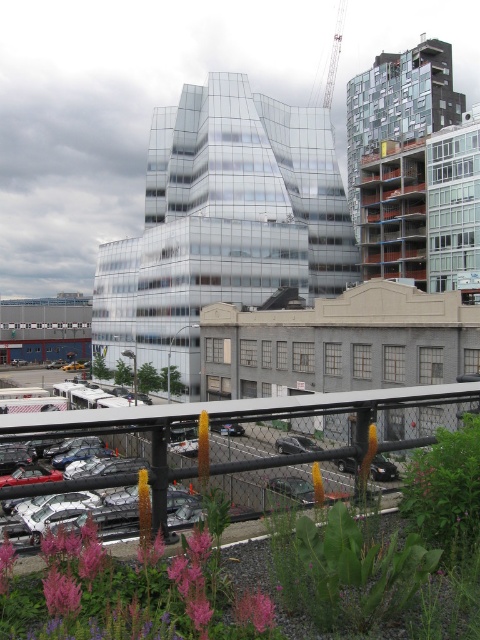
You are an urban planner assessing the space between the green concrete construction site at center and the metallic silver crane at upper center. Can you determine if the construction site is narrower than the crane?

The green concrete construction site at center is narrower than the metallic silver crane at upper center because its width is less than that of the crane.

You are standing on the rooftop garden and looking at two points in the image. The first point is at coordinates point (188,604) and the second is at point (316,449). Which point is closer to you?

Point (188,604) is closer to the viewer than point (316,449).

You are a delivery person trying to reach the shiny black sedan at center. There is a green concrete construction site at center blocking your path. Can you go around it on the right side?

The green concrete construction site at center is positioned on the left side of shiny black sedan at center, so you can go around it on the right side.